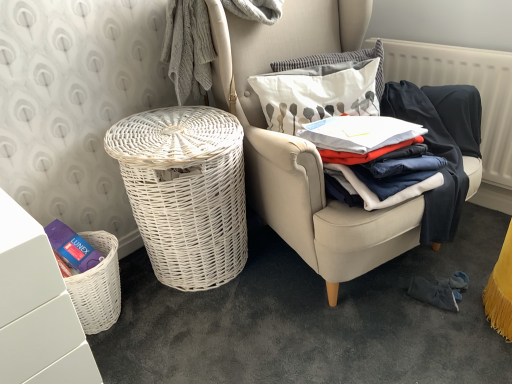
Question: Can you confirm if white textured radiator at upper right is smaller than white wicker chair at center?

Choices:
 (A) yes
 (B) no

Answer: (A)

Question: Does white textured radiator at upper right come behind white wicker chair at center?

Choices:
 (A) no
 (B) yes

Answer: (B)

Question: Is white wicker chair at center a part of white textured radiator at upper right?

Choices:
 (A) yes
 (B) no

Answer: (B)

Question: From a real-world perspective, does white textured radiator at upper right stand above white wicker chair at center?

Choices:
 (A) yes
 (B) no

Answer: (B)

Question: Does white textured radiator at upper right have a larger size compared to white wicker chair at center?

Choices:
 (A) no
 (B) yes

Answer: (A)

Question: Relative to white matte vanity at lower left, is white wicker chair at center in front or behind?

Choices:
 (A) behind
 (B) front

Answer: (A)

Question: In terms of width, does white wicker chair at center look wider or thinner when compared to white matte vanity at lower left?

Choices:
 (A) wide
 (B) thin

Answer: (A)

Question: Does point (288, 198) appear closer or farther from the camera than point (68, 370)?

Choices:
 (A) farther
 (B) closer

Answer: (A)

Question: Considering the positions of white wicker chair at center and white matte vanity at lower left in the image, is white wicker chair at center taller or shorter than white matte vanity at lower left?

Choices:
 (A) tall
 (B) short

Answer: (A)

Question: In terms of height, does white textured pillow at upper center, arranged as the first pillow when viewed from the top, look taller or shorter compared to white fabric pillow at upper right, the 1th pillow ordered from the bottom?

Choices:
 (A) short
 (B) tall

Answer: (A)

Question: Is white textured pillow at upper center, arranged as the first pillow when viewed from the top, situated inside white fabric pillow at upper right, the 1th pillow ordered from the bottom, or outside?

Choices:
 (A) inside
 (B) outside

Answer: (B)

Question: Looking at the image, does white textured pillow at upper center, arranged as the first pillow when viewed from the top, seem bigger or smaller compared to white fabric pillow at upper right, the 1th pillow ordered from the bottom?

Choices:
 (A) big
 (B) small

Answer: (B)

Question: From a real-world perspective, relative to white fabric pillow at upper right, the 1th pillow ordered from the bottom, is white textured pillow at upper center, arranged as the first pillow when viewed from the top, vertically above or below?

Choices:
 (A) above
 (B) below

Answer: (A)

Question: Visually, is white matte vanity at lower left positioned to the left or to the right of white wicker basket at left?

Choices:
 (A) left
 (B) right

Answer: (A)

Question: Considering the positions of white matte vanity at lower left and white wicker basket at left in the image, is white matte vanity at lower left wider or thinner than white wicker basket at left?

Choices:
 (A) thin
 (B) wide

Answer: (B)